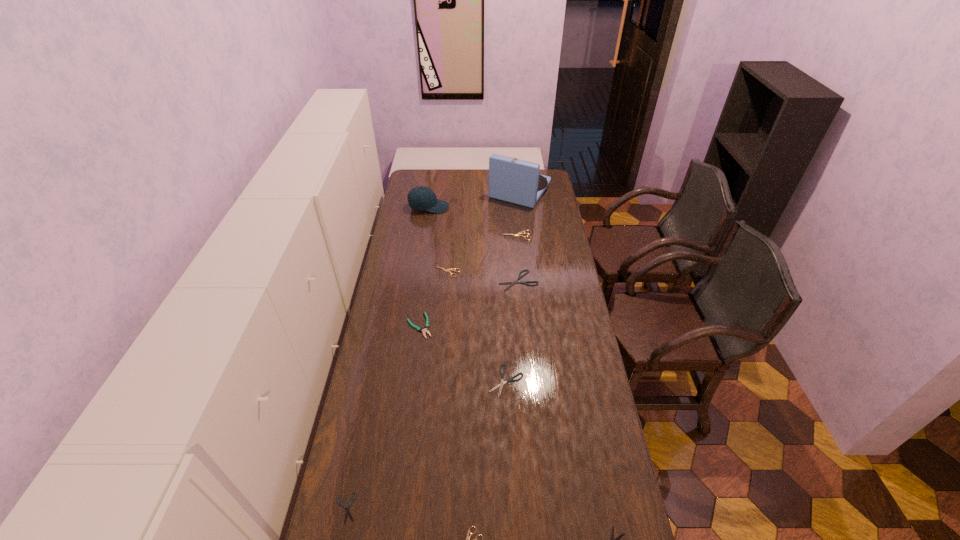
At what (x,y) coordinates should I click in order to perform the action: click on the second biggest beige shears. Please return your answer as a coordinate pair (x, y). Looking at the image, I should click on [x=451, y=269].

Find the location of a particular element. This screenshot has height=540, width=960. the fourth nearest object is located at coordinates (500, 385).

Where is `the second farthest black shears`? the second farthest black shears is located at coordinates (500, 385).

Locate an element on the screen. the shortest shears is located at coordinates (347, 509).

Where is `the leftmost black shears`? This screenshot has height=540, width=960. the leftmost black shears is located at coordinates (347, 509).

Where is `vacant area situated 0.360m on the left of the phonograph record`? vacant area situated 0.360m on the left of the phonograph record is located at coordinates (425, 191).

At what (x,y) coordinates should I click in order to perform the action: click on vacant space positioned on the front-facing side of the blue baseball cap. Please return your answer as a coordinate pair (x, y). Looking at the image, I should click on (469, 207).

Locate an element on the screen. The image size is (960, 540). vacant region located 0.150m on the right of the teal pliers is located at coordinates (469, 326).

Locate an element on the screen. The height and width of the screenshot is (540, 960). free space located on the left of the fourth tallest object is located at coordinates (468, 235).

Locate an element on the screen. The image size is (960, 540). vacant space situated on the back of the farthest black shears is located at coordinates (515, 242).